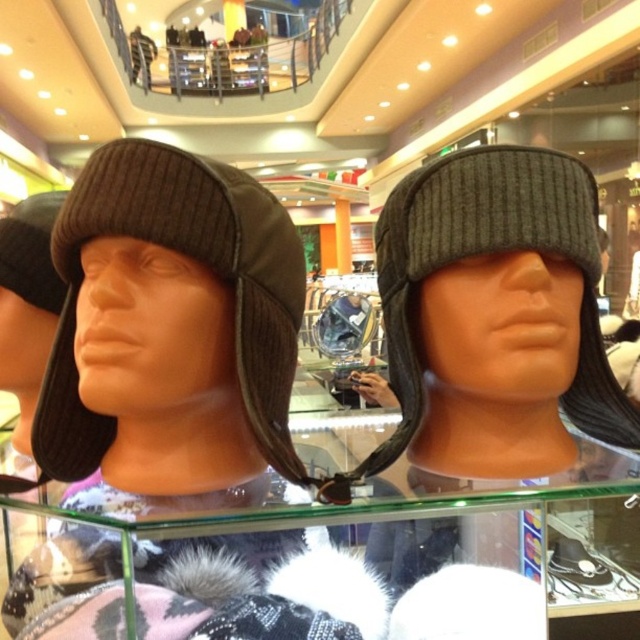
Question: Is dark brown knit hat at left below dark gray ribbed knit hat at center?

Choices:
 (A) no
 (B) yes

Answer: (B)

Question: Does dark brown knit hat at left lie in front of dark gray ribbed knit hat at center?

Choices:
 (A) no
 (B) yes

Answer: (B)

Question: In this image, where is dark brown knit hat at left located relative to dark gray ribbed knit hat at center?

Choices:
 (A) left
 (B) right

Answer: (A)

Question: Which point is closer to the camera taking this photo?

Choices:
 (A) (580, 326)
 (B) (211, 234)

Answer: (B)